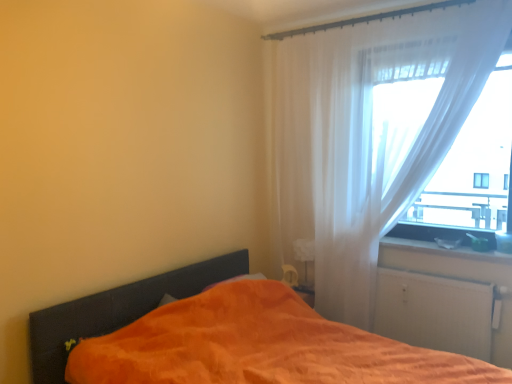
Question: Is point (419, 79) closer or farther from the camera than point (458, 254)?

Choices:
 (A) closer
 (B) farther

Answer: (A)

Question: Considering the positions of sheer white curtain at right and white glossy window sill at lower right in the image, is sheer white curtain at right bigger or smaller than white glossy window sill at lower right?

Choices:
 (A) small
 (B) big

Answer: (B)

Question: Considering the real-world distances, which object is farthest from the white matte radiator at lower right?

Choices:
 (A) sheer white curtain at right
 (B) orange soft fabric bed at lower left
 (C) white glossy window sill at lower right

Answer: (B)

Question: Which is farther from the orange soft fabric bed at lower left?

Choices:
 (A) sheer white curtain at right
 (B) white glossy window sill at lower right
 (C) white matte radiator at lower right

Answer: (B)